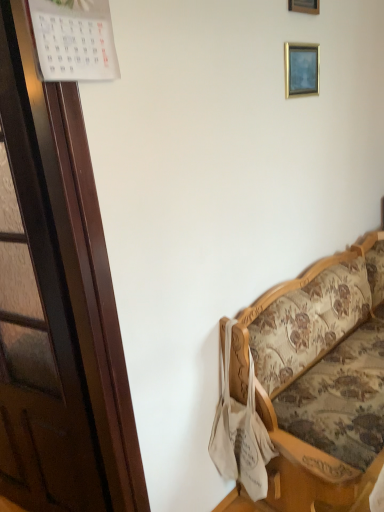
Image resolution: width=384 pixels, height=512 pixels. What are the coordinates of `gold metallic picture frame at upper right, placed as the second picture frame when sorted from top to bottom` in the screenshot? It's located at (301, 69).

Where is `floral fabric couch at right`? The width and height of the screenshot is (384, 512). floral fabric couch at right is located at coordinates click(317, 382).

What is the approximate height of floral fabric couch at right?

floral fabric couch at right is 35.53 inches tall.

You are a GUI agent. You are given a task and a screenshot of the screen. Output one action in this format:
    pyautogui.click(x=<x>, y=<y>)
    Task: Click on the wooden picture frame at upper center, acting as the 2th picture frame starting from the bottom
    Image resolution: width=384 pixels, height=512 pixels.
    Given the screenshot: What is the action you would take?
    pyautogui.click(x=304, y=6)

Does floral fabric couch at right have a smaller size compared to wooden picture frame at upper center, acting as the 2th picture frame starting from the bottom?

No, floral fabric couch at right is not smaller than wooden picture frame at upper center, acting as the 2th picture frame starting from the bottom.

Looking at their sizes, would you say floral fabric couch at right is wider or thinner than wooden picture frame at upper center, acting as the 2th picture frame starting from the bottom?

Clearly, floral fabric couch at right has more width compared to wooden picture frame at upper center, acting as the 2th picture frame starting from the bottom.

Which of these two, floral fabric couch at right or wooden picture frame at upper center, acting as the 2th picture frame starting from the bottom, stands shorter?

Standing shorter between the two is wooden picture frame at upper center, acting as the 2th picture frame starting from the bottom.

Is the position of floral fabric couch at right less distant than that of wooden picture frame at upper center, which is the first picture frame from top to bottom?

Yes, the depth of floral fabric couch at right is less than that of wooden picture frame at upper center, which is the first picture frame from top to bottom.

Considering the relative sizes of gold metallic picture frame at upper right, placed as the second picture frame when sorted from top to bottom, and wooden picture frame at upper center, acting as the 2th picture frame starting from the bottom, in the image provided, is gold metallic picture frame at upper right, placed as the second picture frame when sorted from top to bottom, bigger than wooden picture frame at upper center, acting as the 2th picture frame starting from the bottom,?

Actually, gold metallic picture frame at upper right, placed as the second picture frame when sorted from top to bottom, might be smaller than wooden picture frame at upper center, acting as the 2th picture frame starting from the bottom.

From the image's perspective, which one is positioned higher, gold metallic picture frame at upper right, placed as the second picture frame when sorted from top to bottom, or wooden picture frame at upper center, acting as the 2th picture frame starting from the bottom?

wooden picture frame at upper center, acting as the 2th picture frame starting from the bottom, from the image's perspective.

Is gold metallic picture frame at upper right, placed as the second picture frame when sorted from top to bottom, behind wooden picture frame at upper center, which is the first picture frame from top to bottom?

That is True.

Does point (310, 81) lie in front of point (300, 2)?

That is False.

Can you tell me how much wooden picture frame at upper center, acting as the 2th picture frame starting from the bottom, and floral fabric couch at right differ in facing direction?

1.01 degrees.

Consider the image. From a real-world perspective, is wooden picture frame at upper center, acting as the 2th picture frame starting from the bottom, on floral fabric couch at right?

Yes.

Is floral fabric couch at right at the back of wooden picture frame at upper center, which is the first picture frame from top to bottom?

No, wooden picture frame at upper center, which is the first picture frame from top to bottom,'s orientation is not away from floral fabric couch at right.

From the picture: From the image's perspective, is wooden picture frame at upper center, acting as the 2th picture frame starting from the bottom, positioned above or below floral fabric couch at right?

Based on their image positions, wooden picture frame at upper center, acting as the 2th picture frame starting from the bottom, is located above floral fabric couch at right.

From the picture: Can you tell me how much gold metallic picture frame at upper right, which is the 1th picture frame from bottom to top, and floral fabric couch at right differ in facing direction?

The angle between the facing direction of gold metallic picture frame at upper right, which is the 1th picture frame from bottom to top, and the facing direction of floral fabric couch at right is 1.25 degrees.

Which is nearer, [318,73] or [289,361]?

The point [289,361] is in front.

Looking at this image, which object is more forward, gold metallic picture frame at upper right, which is the 1th picture frame from bottom to top, or floral fabric couch at right?

floral fabric couch at right is more forward.

From a real-world perspective, is gold metallic picture frame at upper right, placed as the second picture frame when sorted from top to bottom, over floral fabric couch at right?

Yes, from a real-world perspective, gold metallic picture frame at upper right, placed as the second picture frame when sorted from top to bottom, is over floral fabric couch at right

Is floral fabric couch at right bigger or smaller than gold metallic picture frame at upper right, placed as the second picture frame when sorted from top to bottom?

floral fabric couch at right is bigger than gold metallic picture frame at upper right, placed as the second picture frame when sorted from top to bottom.

Is floral fabric couch at right with gold metallic picture frame at upper right, placed as the second picture frame when sorted from top to bottom?

floral fabric couch at right is not next to gold metallic picture frame at upper right, placed as the second picture frame when sorted from top to bottom, and they're not touching.

Can you confirm if floral fabric couch at right is taller than gold metallic picture frame at upper right, which is the 1th picture frame from bottom to top?

Correct, floral fabric couch at right is much taller as gold metallic picture frame at upper right, which is the 1th picture frame from bottom to top.

This screenshot has width=384, height=512. Find the location of `the 2nd picture frame behind when counting from the floral fabric couch at right`. the 2nd picture frame behind when counting from the floral fabric couch at right is located at coordinates (301, 69).

From the image's perspective, is wooden picture frame at upper center, which is the first picture frame from top to bottom, below gold metallic picture frame at upper right, placed as the second picture frame when sorted from top to bottom?

No.

Which object is closer to the camera, wooden picture frame at upper center, acting as the 2th picture frame starting from the bottom, or gold metallic picture frame at upper right, which is the 1th picture frame from bottom to top?

wooden picture frame at upper center, acting as the 2th picture frame starting from the bottom, is closer to the camera.

Where is `picture frame that appears on the left of gold metallic picture frame at upper right, placed as the second picture frame when sorted from top to bottom`? picture frame that appears on the left of gold metallic picture frame at upper right, placed as the second picture frame when sorted from top to bottom is located at coordinates (304, 6).

Is wooden picture frame at upper center, which is the first picture frame from top to bottom, wider than gold metallic picture frame at upper right, placed as the second picture frame when sorted from top to bottom?

In fact, wooden picture frame at upper center, which is the first picture frame from top to bottom, might be narrower than gold metallic picture frame at upper right, placed as the second picture frame when sorted from top to bottom.

Find the location of a particular element. The height and width of the screenshot is (512, 384). studio couch lying in front of the wooden picture frame at upper center, acting as the 2th picture frame starting from the bottom is located at coordinates (317, 382).

Identify the location of picture frame below the wooden picture frame at upper center, which is the first picture frame from top to bottom (from the image's perspective). The image size is (384, 512). (301, 69).

Based on their spatial positions, is wooden picture frame at upper center, which is the first picture frame from top to bottom, or gold metallic picture frame at upper right, which is the 1th picture frame from bottom to top, closer to floral fabric couch at right?

gold metallic picture frame at upper right, which is the 1th picture frame from bottom to top, is positioned closer to the anchor floral fabric couch at right.

From the image, which object appears to be farther from gold metallic picture frame at upper right, which is the 1th picture frame from bottom to top, wooden picture frame at upper center, which is the first picture frame from top to bottom, or floral fabric couch at right?

Among the two, floral fabric couch at right is located further to gold metallic picture frame at upper right, which is the 1th picture frame from bottom to top.

Based on their spatial positions, is floral fabric couch at right or wooden picture frame at upper center, acting as the 2th picture frame starting from the bottom, further from gold metallic picture frame at upper right, which is the 1th picture frame from bottom to top?

Based on the image, floral fabric couch at right appears to be further to gold metallic picture frame at upper right, which is the 1th picture frame from bottom to top.

Considering their positions, is floral fabric couch at right positioned further to wooden picture frame at upper center, which is the first picture frame from top to bottom, than gold metallic picture frame at upper right, placed as the second picture frame when sorted from top to bottom?

The object further to wooden picture frame at upper center, which is the first picture frame from top to bottom, is floral fabric couch at right.

From the image, which object appears to be nearer to wooden picture frame at upper center, which is the first picture frame from top to bottom, gold metallic picture frame at upper right, placed as the second picture frame when sorted from top to bottom, or floral fabric couch at right?

gold metallic picture frame at upper right, placed as the second picture frame when sorted from top to bottom, is positioned closer to the anchor wooden picture frame at upper center, which is the first picture frame from top to bottom.

Based on their spatial positions, is gold metallic picture frame at upper right, which is the 1th picture frame from bottom to top, or wooden picture frame at upper center, acting as the 2th picture frame starting from the bottom, closer to floral fabric couch at right?

gold metallic picture frame at upper right, which is the 1th picture frame from bottom to top, is positioned closer to the anchor floral fabric couch at right.

Find the location of `picture frame between wooden picture frame at upper center, which is the first picture frame from top to bottom, and floral fabric couch at right from top to bottom`. picture frame between wooden picture frame at upper center, which is the first picture frame from top to bottom, and floral fabric couch at right from top to bottom is located at coordinates (301, 69).